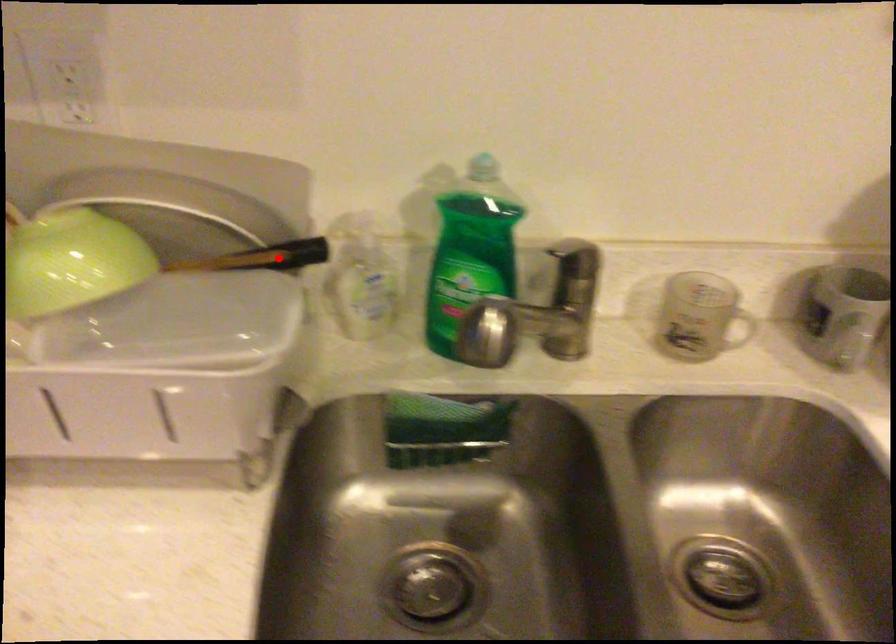
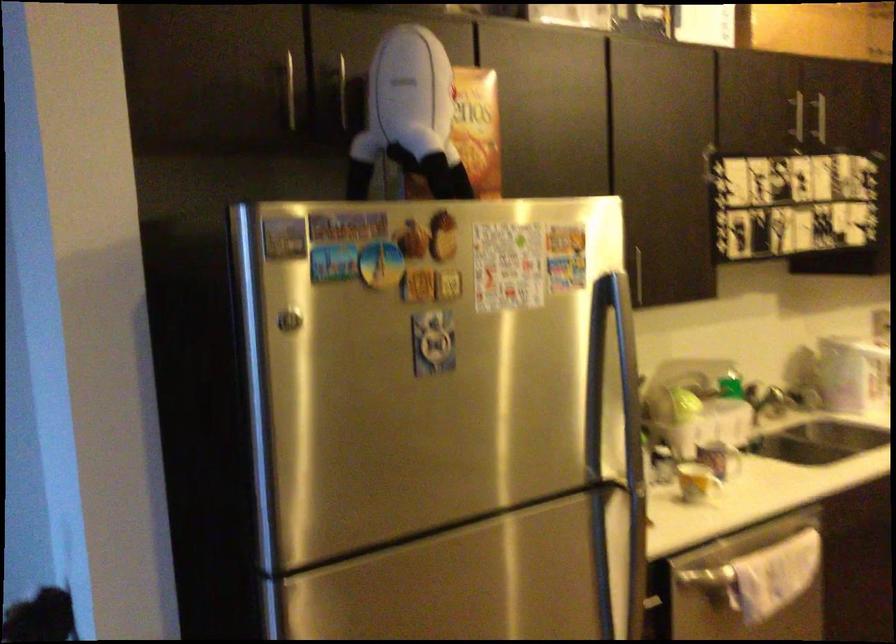
Question: I am providing you with two images of the same scene from different viewpoints. A red point is marked on the first image. Is the red point's position out of view in image 2?

Choices:
 (A) Yes
 (B) No

Answer: (A)